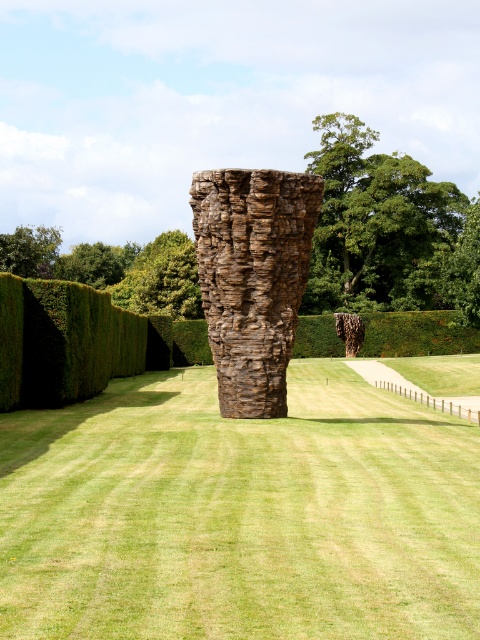
You are standing in the garden and want to take a photo of the brown textured rock at center and the green leafy tree at upper left. Which object should you frame first in your camera viewfinder to ensure both are in the shot?

You should frame the green leafy tree at upper left first because the brown textured rock at center is to the right of it, so positioning the tree first allows you to include both in the frame.

You are planning to install a new garden light. The light requires a mounting point that is at least 1.5 meters tall to ensure proper visibility. Based on the scene, can the brown textured rock at center or the green leafy tree at upper left serve as a suitable mounting point?

The green leafy tree at upper left is taller than the brown textured rock at center, so the green leafy tree at upper left would be a suitable mounting point for the garden light as it meets the height requirement of at least 1.5 meters.

You are standing in the garden and want to take a photo of the sculpture. You notice two green leafy trees in the background. Which tree, the green leafy tree at upper center or the green leafy tree at upper left, is closer to the sculpture?

The green leafy tree at upper center is closer to the sculpture because it is positioned below the green leafy tree at upper left, meaning it is lower in the image and thus nearer to the sculpture located at the garden.